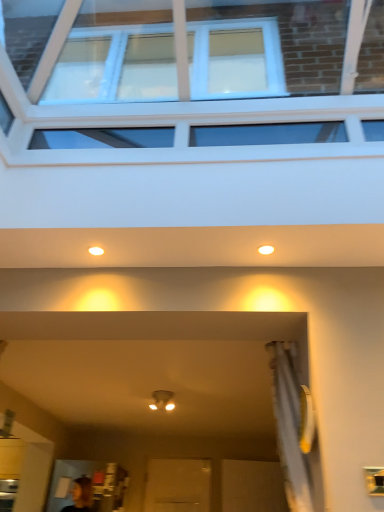
Question: Considering the relative sizes of matte white light fixture at upper center, which is the second lighting from left to right, and matte white light fixture at upper center, which is the 2th lighting from right to left, in the image provided, is matte white light fixture at upper center, which is the second lighting from left to right, bigger than matte white light fixture at upper center, which is the 2th lighting from right to left,?

Choices:
 (A) yes
 (B) no

Answer: (B)

Question: Can you confirm if matte white light fixture at upper center, which is the second lighting from left to right, is shorter than matte white light fixture at upper center, which is the 2th lighting from right to left?

Choices:
 (A) yes
 (B) no

Answer: (A)

Question: Is matte white light fixture at upper center, the 1th lighting positioned from the right, directly adjacent to matte white light fixture at upper center, which is the 2th lighting from right to left?

Choices:
 (A) yes
 (B) no

Answer: (B)

Question: Is matte white light fixture at upper center, which is the second lighting from left to right, turned away from matte white light fixture at upper center, which is the 2th lighting from right to left?

Choices:
 (A) yes
 (B) no

Answer: (B)

Question: Does matte white light fixture at upper center, which is the second lighting from left to right, lie behind matte white light fixture at upper center, which is the 2th lighting from right to left?

Choices:
 (A) yes
 (B) no

Answer: (B)

Question: From a real-world perspective, is matte white light fixture at upper center, which is the second lighting from left to right, physically located above or below matte white light fixture at center?

Choices:
 (A) above
 (B) below

Answer: (A)

Question: From the image's perspective, is matte white light fixture at upper center, which is the second lighting from left to right, positioned above or below matte white light fixture at center?

Choices:
 (A) below
 (B) above

Answer: (B)

Question: Looking at their shapes, would you say matte white light fixture at upper center, which is the second lighting from left to right, is wider or thinner than matte white light fixture at center?

Choices:
 (A) wide
 (B) thin

Answer: (B)

Question: Is matte white light fixture at upper center, which is the second lighting from left to right, to the left or to the right of matte white light fixture at center in the image?

Choices:
 (A) left
 (B) right

Answer: (B)

Question: Is matte white light fixture at upper center, the 1th lighting positioned from the right, taller or shorter than matte white light fixture at upper center, marked as the first lighting in a left-to-right arrangement?

Choices:
 (A) short
 (B) tall

Answer: (A)

Question: Considering the positions of matte white light fixture at upper center, the 1th lighting positioned from the right, and matte white light fixture at upper center, marked as the first lighting in a left-to-right arrangement, in the image, is matte white light fixture at upper center, the 1th lighting positioned from the right, bigger or smaller than matte white light fixture at upper center, marked as the first lighting in a left-to-right arrangement,?

Choices:
 (A) big
 (B) small

Answer: (B)

Question: Considering their positions, is matte white light fixture at upper center, the 1th lighting positioned from the right, located in front of or behind matte white light fixture at upper center, which is the 2th lighting from right to left?

Choices:
 (A) front
 (B) behind

Answer: (A)

Question: From the image's perspective, is matte white light fixture at upper center, which is the second lighting from left to right, above or below matte white light fixture at upper center, marked as the first lighting in a left-to-right arrangement?

Choices:
 (A) below
 (B) above

Answer: (B)

Question: Relative to clear glass window at upper center, is matte white light fixture at center in front or behind?

Choices:
 (A) behind
 (B) front

Answer: (A)

Question: Looking at their shapes, would you say matte white light fixture at center is wider or thinner than clear glass window at upper center?

Choices:
 (A) wide
 (B) thin

Answer: (B)